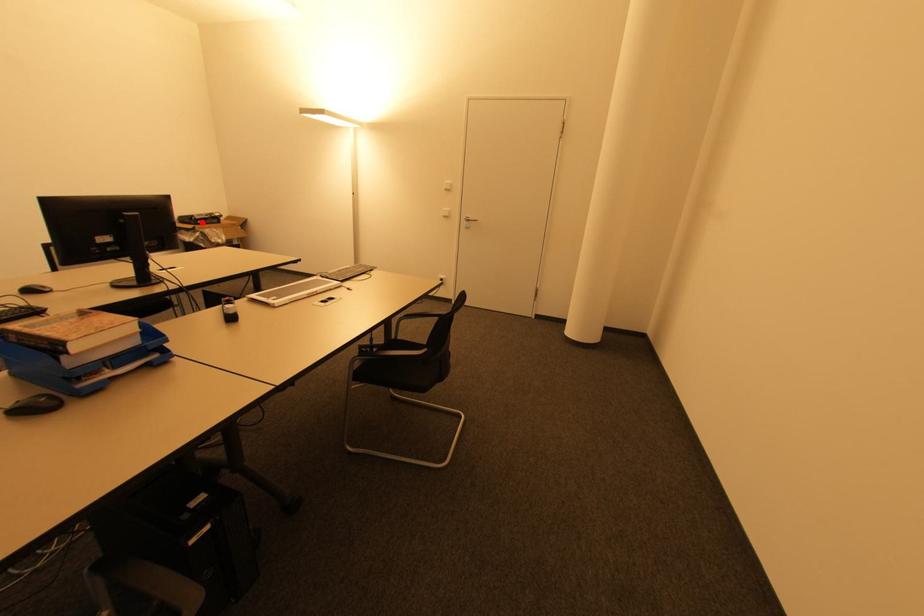
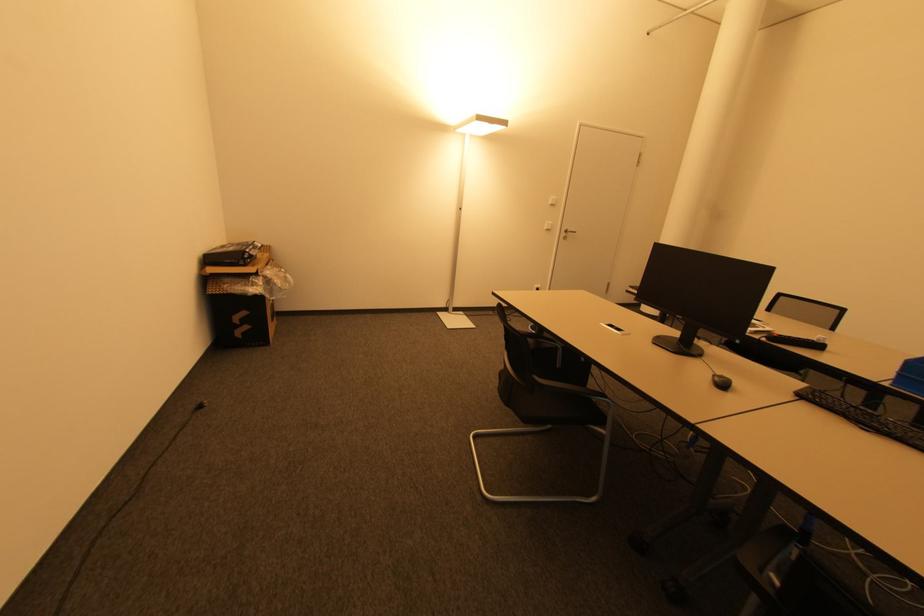
Find the pixel in the second image that matches the highlighted location in the first image.

(250, 261)